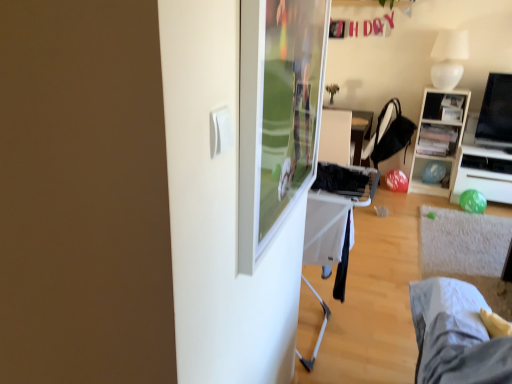
Question: Is black glossy tv at right in front of or behind white fabric bed at lower right in the image?

Choices:
 (A) front
 (B) behind

Answer: (B)

Question: Considering the positions of point (485, 102) and point (504, 365), is point (485, 102) closer or farther from the camera than point (504, 365)?

Choices:
 (A) closer
 (B) farther

Answer: (B)

Question: Considering the real-world distances, which object is closest to the black glossy tv at right?

Choices:
 (A) black fabric chair at center
 (B) white fabric bed at lower right
 (C) black plastic table at center
 (D) white glossy lamp at upper right
 (E) wooden shelf at right

Answer: (E)

Question: Which object is the closest to the black plastic table at center?

Choices:
 (A) black glossy tv at right
 (B) wooden shelf at upper right
 (C) green matte desk at right
 (D) white glossy lamp at upper right
 (E) black fabric chair at center

Answer: (E)